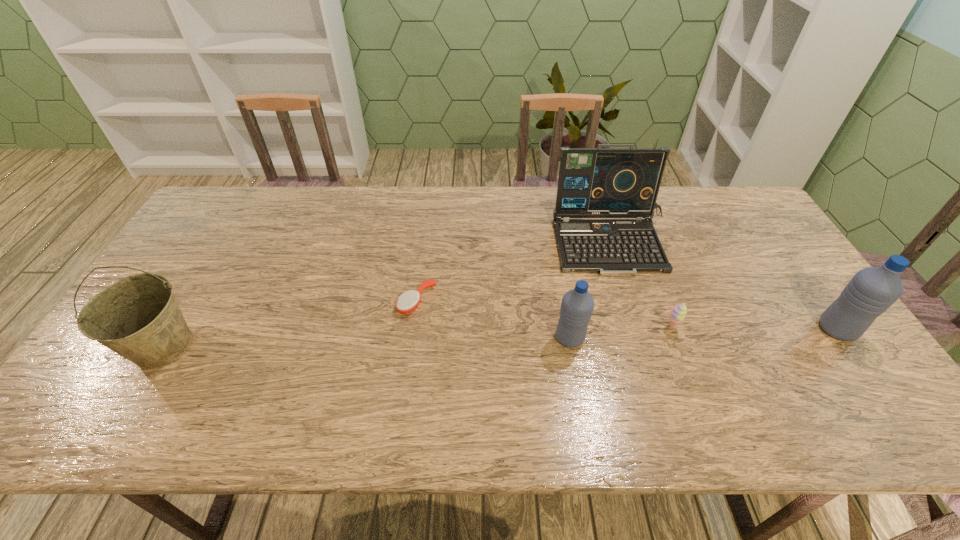
You are a GUI agent. You are given a task and a screenshot of the screen. Output one action in this format:
    pyautogui.click(x=<x>, y=<y>)
    Task: Click on the free point that keeps the water bottles evenly spaced on the left
    This screenshot has height=540, width=960.
    Given the screenshot: What is the action you would take?
    pyautogui.click(x=294, y=347)